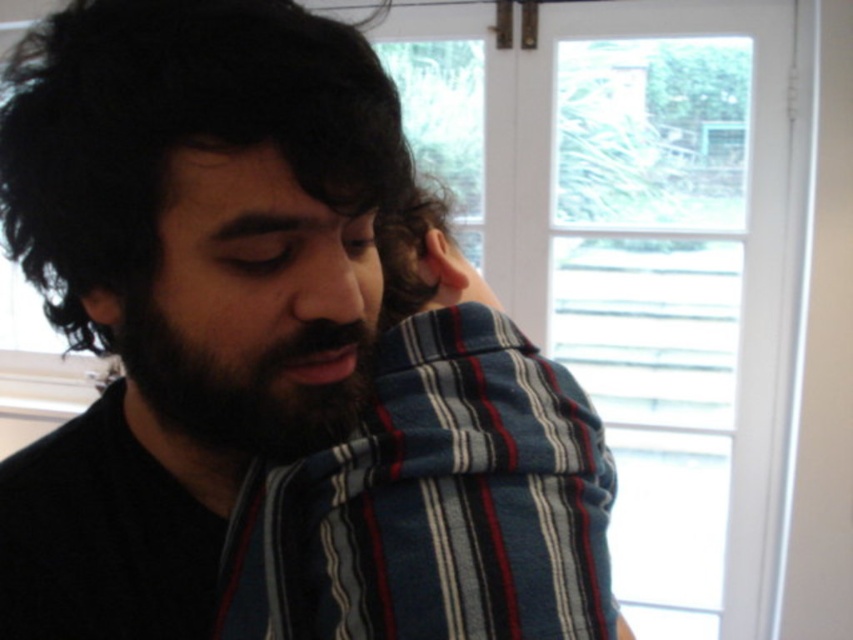
Is point (9, 209) positioned behind point (132, 310)?

Yes, it is.

Can you confirm if dark curly hair at upper left is positioned below dark brown fuzzy beard at center?

No, dark curly hair at upper left is not below dark brown fuzzy beard at center.

Is point (180, 22) closer to viewer compared to point (136, 310)?

Yes.

Locate an element on the screen. dark curly hair at upper left is located at coordinates (175, 129).

Looking at this image, does dark curly hair at upper left have a lesser width compared to dark brown skin at center?

In fact, dark curly hair at upper left might be wider than dark brown skin at center.

Can you confirm if dark curly hair at upper left is smaller than dark brown skin at center?

No.

Is point (30, 65) positioned in front of point (190, 440)?

Yes.

Identify the location of dark curly hair at upper left. (175, 129).

Is dark brown fuzzy beard at center taller than dark brown skin at center?

Indeed, dark brown fuzzy beard at center has a greater height compared to dark brown skin at center.

The height and width of the screenshot is (640, 853). I want to click on dark brown fuzzy beard at center, so click(x=242, y=385).

Identify the location of dark brown fuzzy beard at center. (242, 385).